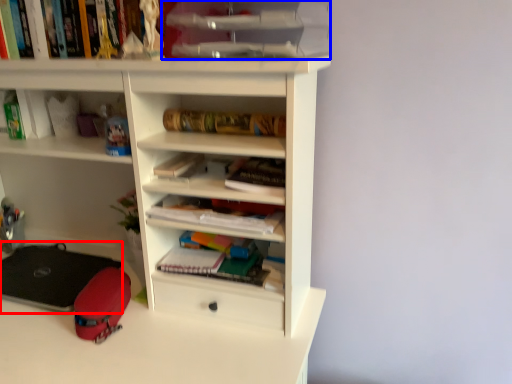
Question: Which of the following is the farthest to the observer, equipment (highlighted by a red box) or cabinet (highlighted by a blue box)?

Choices:
 (A) equipment
 (B) cabinet

Answer: (A)